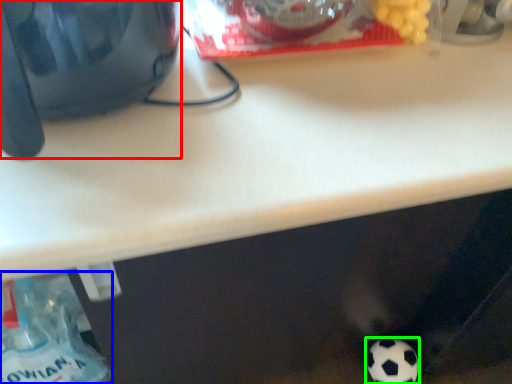
Question: Estimate the real-world distances between objects in this image. Which object is closer to appliance (highlighted by a red box), bottle (highlighted by a blue box) or football (highlighted by a green box)?

Choices:
 (A) bottle
 (B) football

Answer: (A)